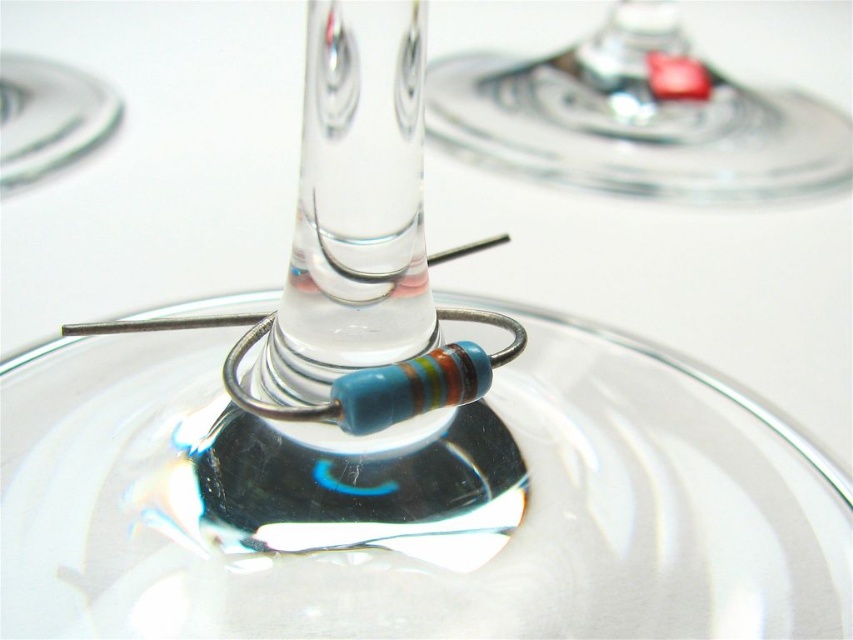
Who is higher up, transparent glass at center or transparent glass at upper center?

transparent glass at upper center is higher up.

This screenshot has width=853, height=640. Describe the element at coordinates (412, 502) in the screenshot. I see `transparent glass at center` at that location.

Is point (648, 380) behind point (639, 65)?

No, it is not.

At what (x,y) coordinates should I click in order to perform the action: click on transparent glass at center. Please return your answer as a coordinate pair (x, y). The width and height of the screenshot is (853, 640). Looking at the image, I should click on (412, 502).